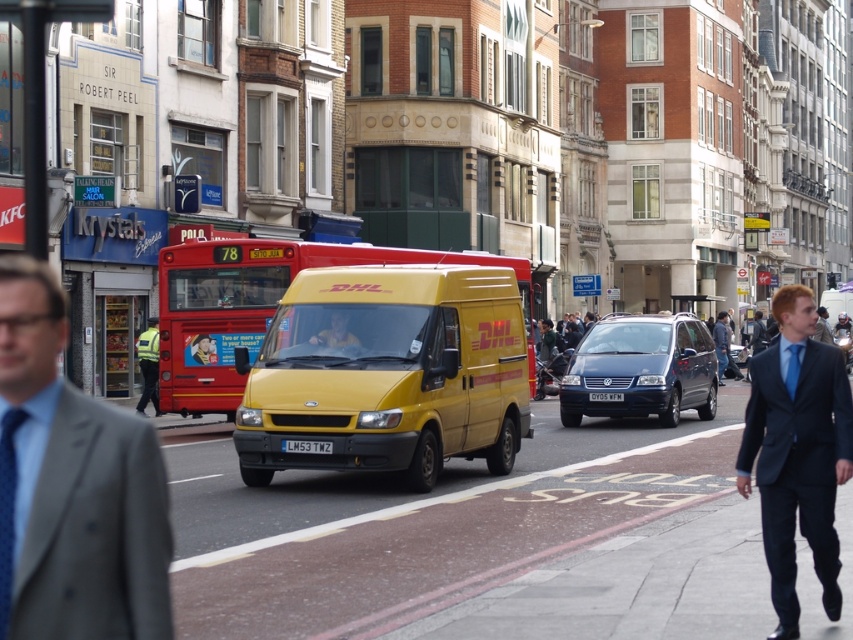
Can you confirm if yellow matte van at center is wider than matte yellow van at center?

Yes, yellow matte van at center is wider than matte yellow van at center.

Which is below, yellow matte van at center or matte yellow van at center?

yellow matte van at center is lower down.

Locate an element on the screen. This screenshot has height=640, width=853. yellow matte van at center is located at coordinates (387, 374).

This screenshot has height=640, width=853. Find the location of `yellow matte van at center`. yellow matte van at center is located at coordinates (387, 374).

Is yellow matte van at center thinner than gray suit at center?

In fact, yellow matte van at center might be wider than gray suit at center.

Does yellow matte van at center lie in front of gray suit at center?

That is False.

Is point (407, 304) farther from viewer compared to point (15, 392)?

Yes.

The height and width of the screenshot is (640, 853). What are the coordinates of `yellow matte van at center` in the screenshot? It's located at (387, 374).

Is dark blue suit at right closer to camera compared to denim jacket at center?

Yes, dark blue suit at right is closer to the viewer.

Is dark blue suit at right wider than denim jacket at center?

No.

Between point (759, 364) and point (721, 358), which one is positioned in front?

Point (759, 364) is in front.

Locate an element on the screen. This screenshot has width=853, height=640. dark blue suit at right is located at coordinates (798, 456).